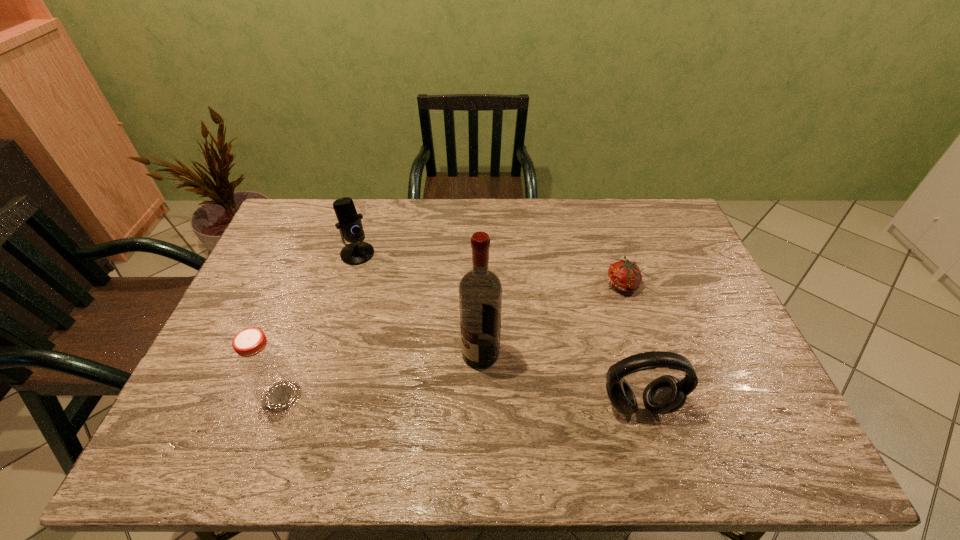
At what (x,y) coordinates should I click in order to perform the action: click on free spot located on the stand of the farthest object. Please return your answer as a coordinate pair (x, y). Looking at the image, I should click on pos(402,349).

Where is `free space located on the front-facing side of the shortest object`? The width and height of the screenshot is (960, 540). free space located on the front-facing side of the shortest object is located at coordinates (550, 359).

At what (x,y) coordinates should I click in order to perform the action: click on vacant space situated on the front-facing side of the shortest object. Please return your answer as a coordinate pair (x, y). Image resolution: width=960 pixels, height=540 pixels. Looking at the image, I should click on (595, 313).

This screenshot has width=960, height=540. In order to click on vacant space located 0.170m on the front-facing side of the shortest object in this screenshot , I will do `click(582, 327)`.

Identify the location of free location located 0.180m on the front and back of the tallest object. This screenshot has height=540, width=960. (409, 404).

Locate an element on the screen. The height and width of the screenshot is (540, 960). vacant area located 0.150m on the front and back of the tallest object is located at coordinates (419, 397).

Locate an element on the screen. Image resolution: width=960 pixels, height=540 pixels. free space located 0.230m on the front and back of the tallest object is located at coordinates (391, 416).

Where is `bottle at the near edge`? bottle at the near edge is located at coordinates (263, 366).

Identify the location of headset positioned at the near edge. Image resolution: width=960 pixels, height=540 pixels. pos(666,394).

In the image, there is a desktop. Identify the location of vacant area at the far edge. This screenshot has width=960, height=540. (372, 203).